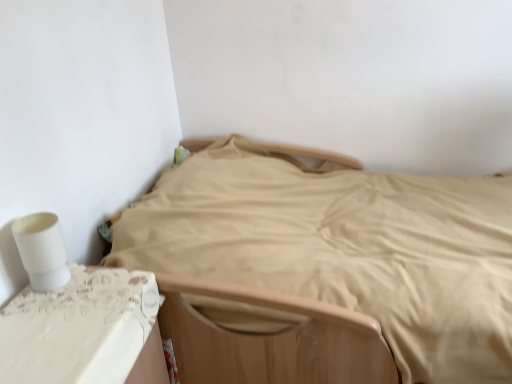
Where is `free spot above white lace table at lower left (from a real-world perspective)`? free spot above white lace table at lower left (from a real-world perspective) is located at coordinates (65, 318).